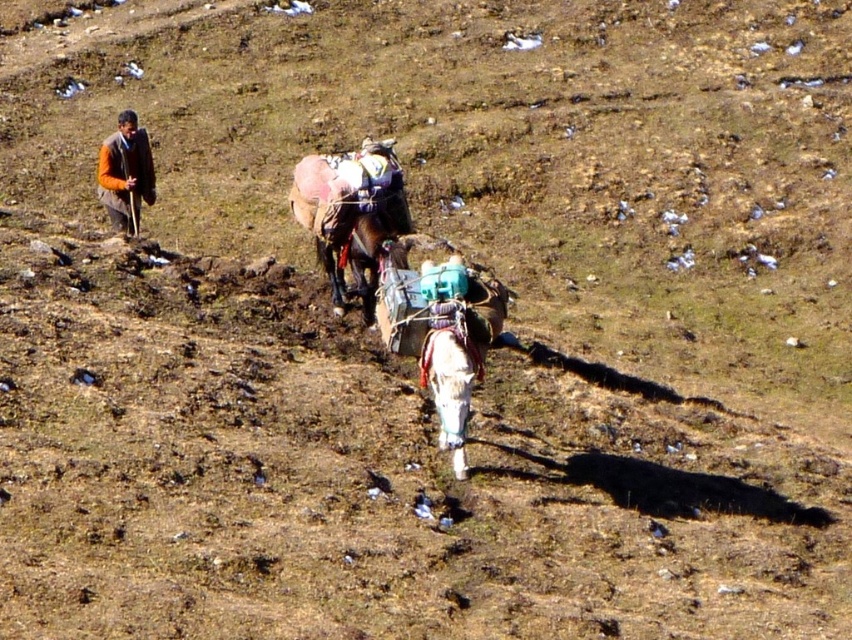
Between brown leather mule at center and white woolen blanket at center, which one has less height?

With less height is white woolen blanket at center.

Does point (354, 150) come in front of point (435, 364)?

That is False.

The width and height of the screenshot is (852, 640). In order to click on brown leather mule at center in this screenshot , I will do `click(350, 212)`.

Locate an element on the screen. The width and height of the screenshot is (852, 640). brown leather mule at center is located at coordinates (350, 212).

Between brown leather mule at center and brown woolen sweater at upper left, which one is positioned higher?

Positioned higher is brown woolen sweater at upper left.

In order to click on brown leather mule at center in this screenshot , I will do `click(350, 212)`.

Who is more forward, (447, 392) or (119, 131)?

Point (447, 392)

Is white woolen blanket at center above brown woolen sweater at upper left?

Actually, white woolen blanket at center is below brown woolen sweater at upper left.

Does point (446, 384) come closer to viewer compared to point (130, 224)?

Yes, it is in front of point (130, 224).

In order to click on white woolen blanket at center in this screenshot , I will do `click(450, 388)`.